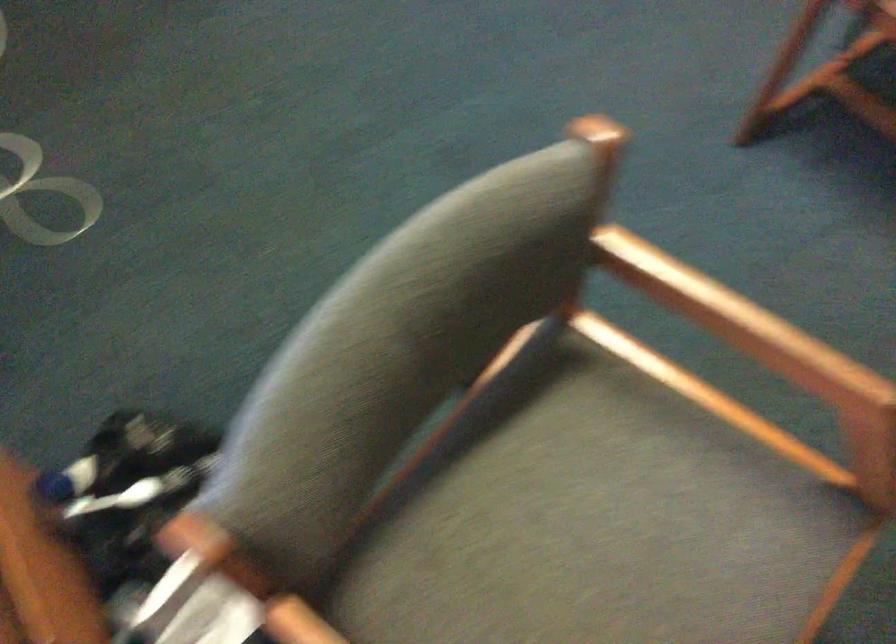
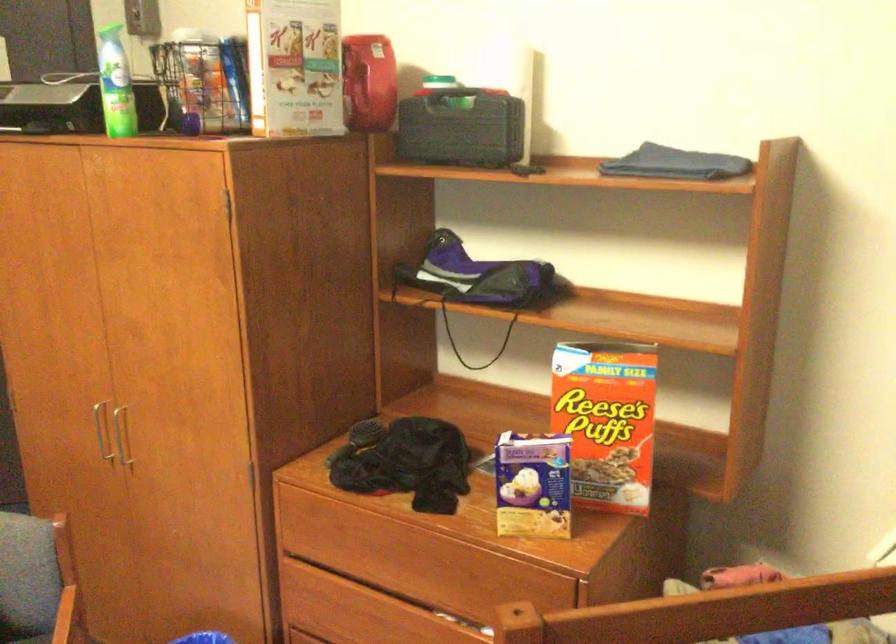
Question: The first image is from the beginning of the video and the second image is from the end. How did the camera likely rotate when shooting the video?

Choices:
 (A) Left
 (B) Right
 (C) Up
 (D) Down

Answer: (B)